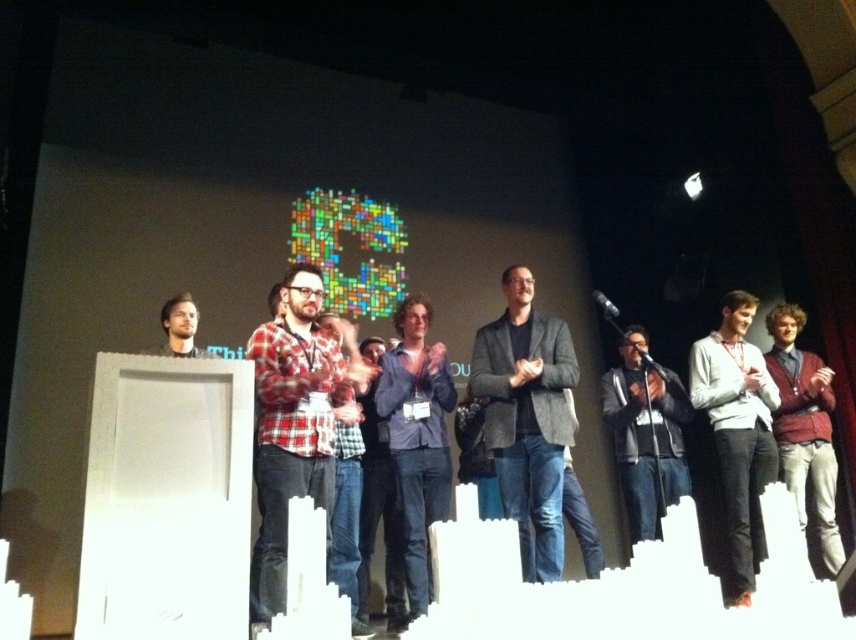
You are an event photographer positioned at the back of the auditorium. You need to capture a photo of the blue denim jeans at center and the dark gray sweater at center. Which object should you adjust your camera focus to first to ensure both are in the frame?

You should focus on the dark gray sweater at center first because the blue denim jeans at center is to the left of it, so adjusting focus from right to left will ensure both are captured.

Looking at this image, you are a photographer taking a picture of the blue denim jeans at center and dark gray sweater at center. Which object should you focus on if you want to capture the wider one?

The dark gray sweater at center is wider than the blue denim jeans at center, so you should focus on the dark gray sweater at center to capture the wider one.